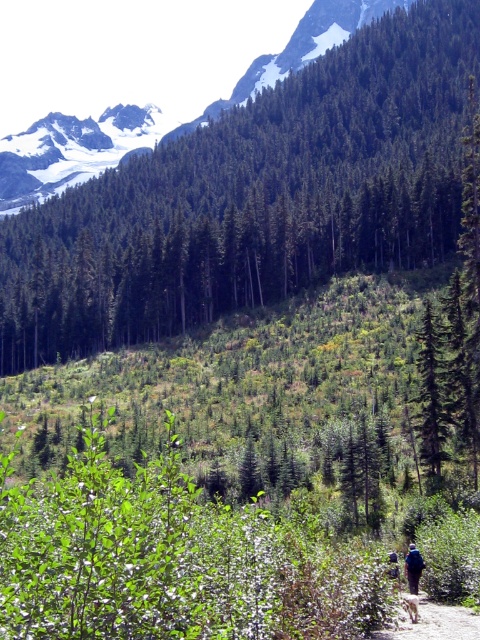
Which is above, green matte tree at center or dirt path at lower right?

green matte tree at center is higher up.

Does green matte tree at center lie in front of dirt path at lower right?

No.

Identify the location of green matte tree at center. The image size is (480, 640). (254, 196).

Find the location of a particular element. The width and height of the screenshot is (480, 640). green matte tree at center is located at coordinates (254, 196).

Who is lower down, dirt path at lower right or blue fabric backpack at lower right?

Positioned lower is blue fabric backpack at lower right.

Who is positioned more to the left, dirt path at lower right or blue fabric backpack at lower right?

From the viewer's perspective, dirt path at lower right appears more on the left side.

I want to click on dirt path at lower right, so click(x=433, y=621).

Find the location of a particular element. Image resolution: width=480 pixels, height=640 pixels. dirt path at lower right is located at coordinates (433, 621).

Which of these two, green matte tree at center or blue fabric backpack at lower right, stands shorter?

blue fabric backpack at lower right is shorter.

Which is in front, point (133, 220) or point (408, 568)?

Point (408, 568) is in front.

Who is more distant from viewer, [160,276] or [408,561]?

Point [160,276]

Locate an element on the screen. The height and width of the screenshot is (640, 480). green matte tree at center is located at coordinates (254, 196).